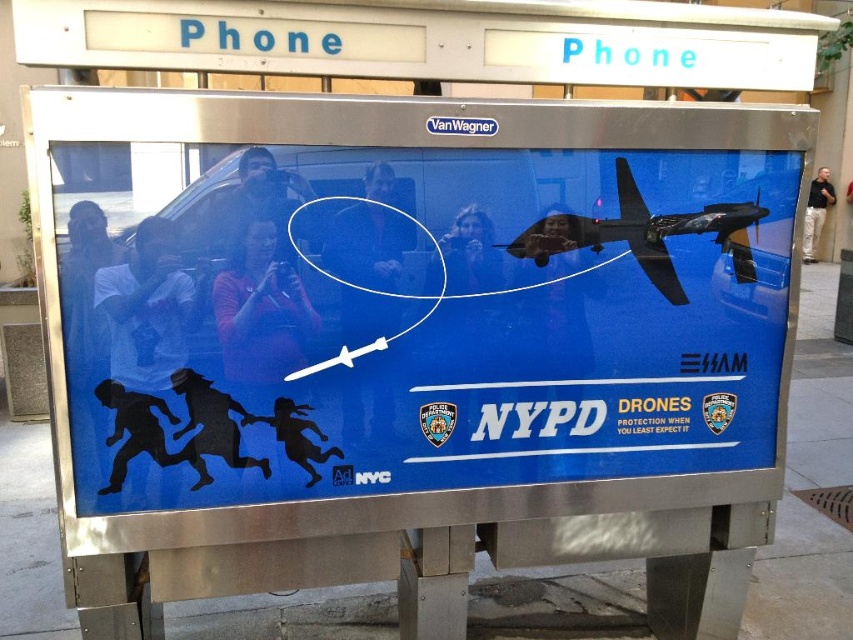
Is blue matte airplane at center taller than shiny black drone at upper right?

Correct, blue matte airplane at center is much taller as shiny black drone at upper right.

Which is in front, point (677, 392) or point (643, 218)?

Point (643, 218) is more forward.

The width and height of the screenshot is (853, 640). I want to click on blue matte airplane at center, so click(440, 326).